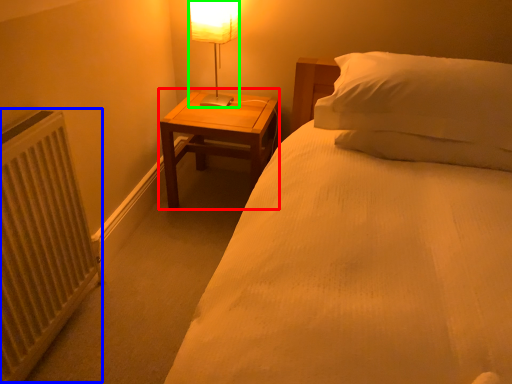
Question: Considering the real-world distances, which object is farthest from nightstand (highlighted by a red box)? radiator (highlighted by a blue box) or table lamp (highlighted by a green box)?

Choices:
 (A) radiator
 (B) table lamp

Answer: (A)